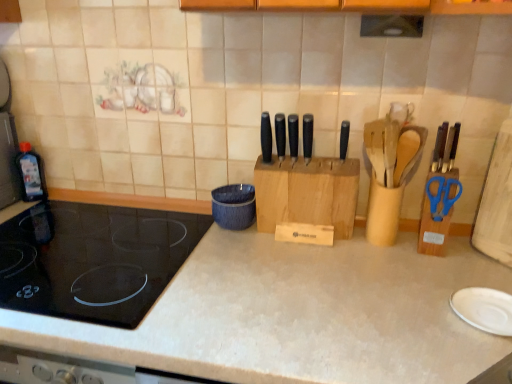
The width and height of the screenshot is (512, 384). In order to click on free space between transparent plastic bottle at left and blue textured bowl at center in this screenshot , I will do `click(133, 213)`.